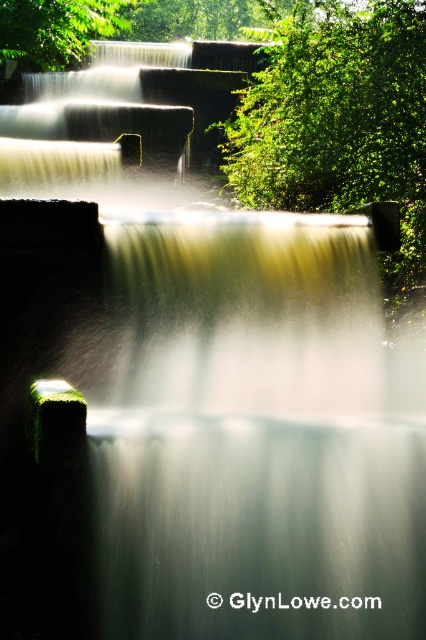
Consider the image. Measure the distance from green leafy tree at upper center to green leafy tree at upper left.

green leafy tree at upper center and green leafy tree at upper left are 7.42 meters apart.

Is green leafy tree at upper center positioned at the back of green leafy tree at upper left?

No, it is not.

This screenshot has width=426, height=640. What do you see at coordinates (339, 116) in the screenshot? I see `green leafy tree at upper center` at bounding box center [339, 116].

I want to click on green leafy tree at upper center, so click(339, 116).